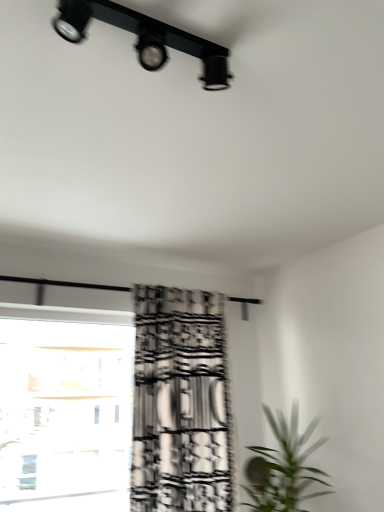
Question: In terms of width, does green leafy plant at lower right look wider or thinner when compared to black matte track light at upper center?

Choices:
 (A) wide
 (B) thin

Answer: (A)

Question: Considering their positions, is green leafy plant at lower right located in front of or behind black matte track light at upper center?

Choices:
 (A) front
 (B) behind

Answer: (B)

Question: Which object is positioned farthest from the black matte track light at upper center?

Choices:
 (A) green leafy plant at lower right
 (B) black printed fabric curtain at center
 (C) transparent glass window at lower left

Answer: (C)

Question: Which object is positioned closest to the green leafy plant at lower right?

Choices:
 (A) black printed fabric curtain at center
 (B) black matte track light at upper center
 (C) transparent glass window at lower left

Answer: (A)